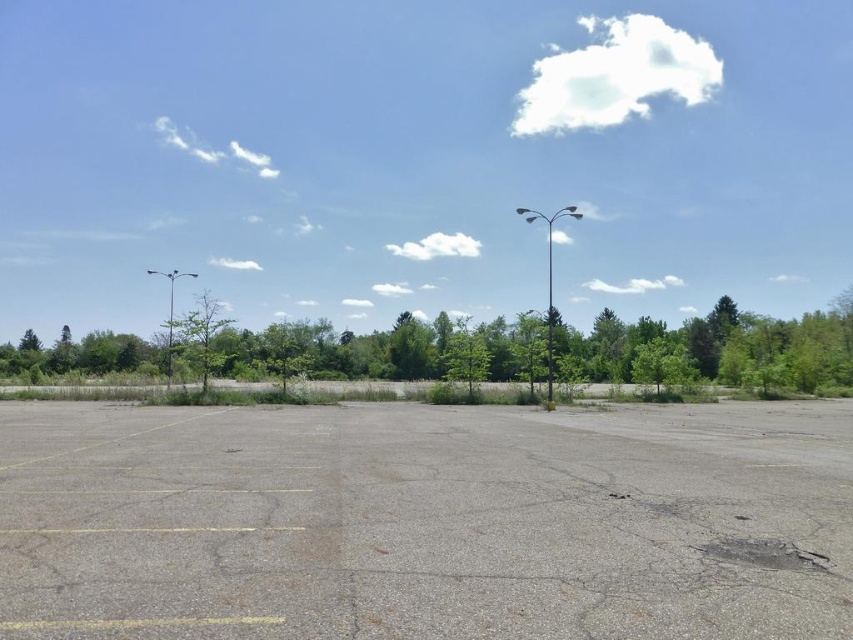
The height and width of the screenshot is (640, 853). What do you see at coordinates (426, 522) in the screenshot? I see `gray asphalt parking lot at center` at bounding box center [426, 522].

Between gray asphalt parking lot at center and green leafy tree at center, which one is positioned higher?

green leafy tree at center

Does point (682, 444) lie in front of point (607, 310)?

Yes, point (682, 444) is in front of point (607, 310).

This screenshot has height=640, width=853. Find the location of `gray asphalt parking lot at center`. gray asphalt parking lot at center is located at coordinates (426, 522).

Does green leafy tree at center have a larger size compared to metallic silver pole at center?

Yes.

Does point (639, 378) come in front of point (549, 280)?

Yes, point (639, 378) is in front of point (549, 280).

Locate an element on the screen. Image resolution: width=853 pixels, height=640 pixels. green leafy tree at center is located at coordinates (712, 349).

Is the position of metallic silver pole at center less distant than that of metallic pole at left?

Yes, metallic silver pole at center is closer to the viewer.

Which is below, metallic silver pole at center or metallic pole at left?

Positioned lower is metallic pole at left.

Who is more forward, (x=548, y=300) or (x=167, y=376)?

Point (x=167, y=376) is in front.

The height and width of the screenshot is (640, 853). In order to click on metallic silver pole at center in this screenshot , I will do `click(549, 320)`.